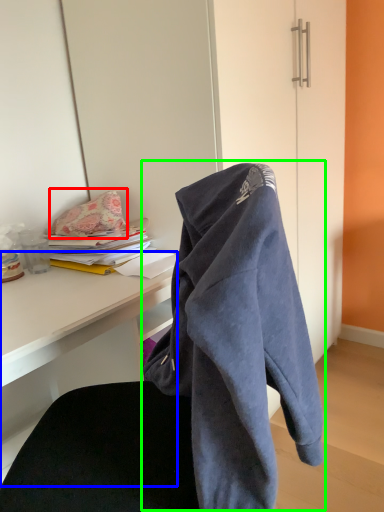
Question: Estimate the real-world distances between objects in this image. Which object is closer to pillow (highlighted by a red box), desk (highlighted by a blue box) or bath towel (highlighted by a green box)?

Choices:
 (A) desk
 (B) bath towel

Answer: (A)